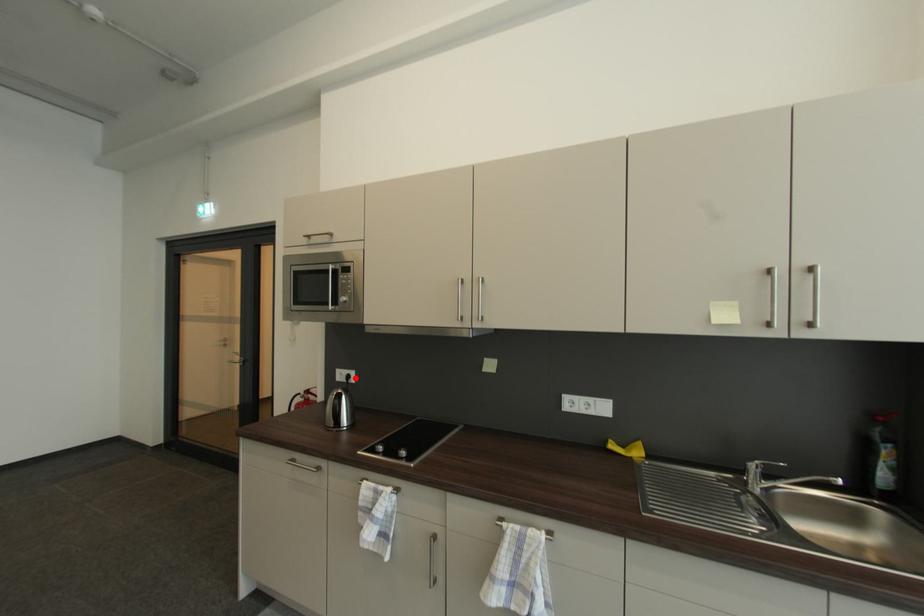
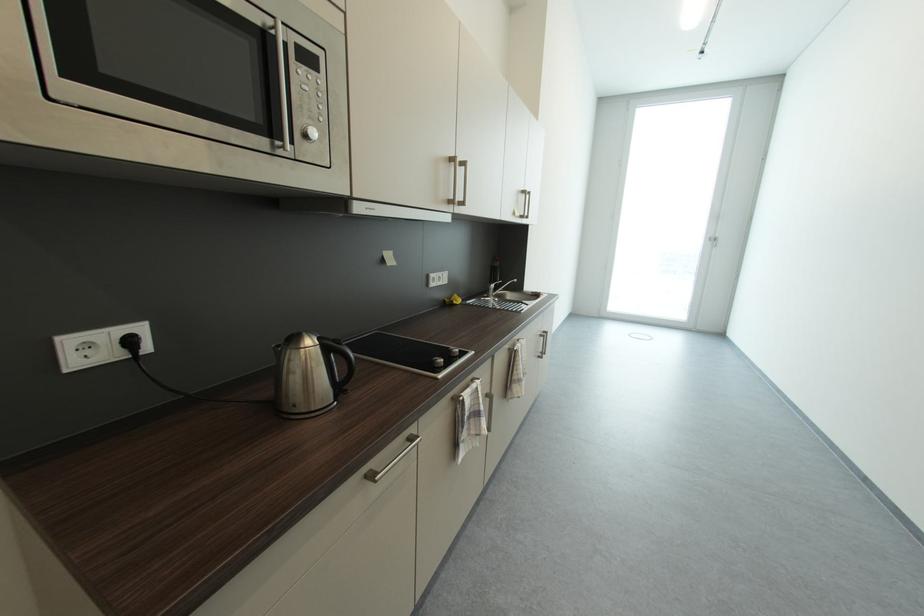
In the second image, find the point that corresponds to the highlighted location in the first image.

(137, 344)